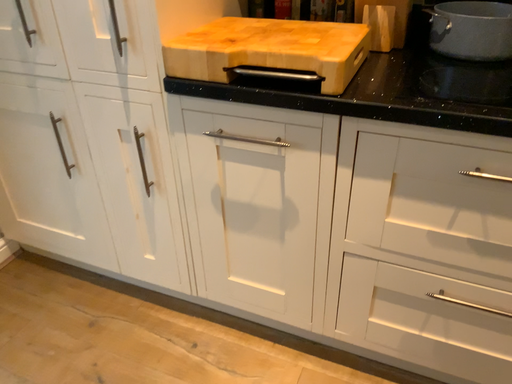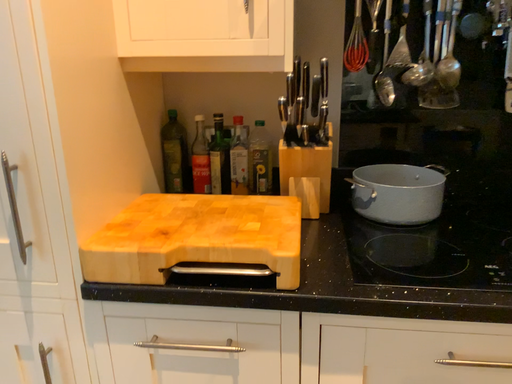
Question: Which way did the camera rotate in the video?

Choices:
 (A) rotated downward
 (B) rotated upward

Answer: (B)